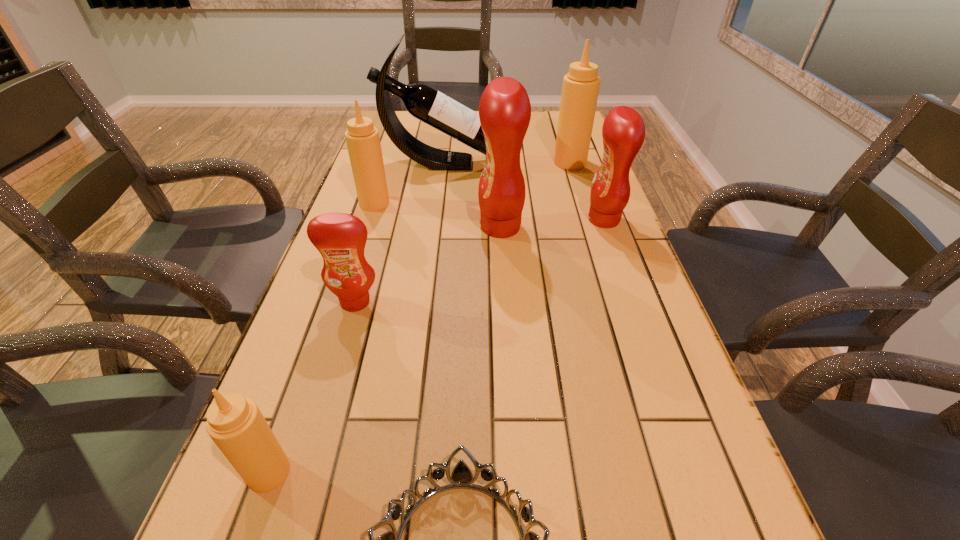
This screenshot has height=540, width=960. What are the coordinates of `wine bottle` in the screenshot? It's located at (423, 102).

The height and width of the screenshot is (540, 960). Find the location of `the biggest red condiment`. the biggest red condiment is located at coordinates pos(504,110).

You are a GUI agent. You are given a task and a screenshot of the screen. Output one action in this format:
    pyautogui.click(x=<x>, y=<y>)
    Task: Click on the fourth condiment from left to right
    Image resolution: width=960 pixels, height=540 pixels.
    Given the screenshot: What is the action you would take?
    pyautogui.click(x=504, y=110)

Where is `the farthest condiment`? The width and height of the screenshot is (960, 540). the farthest condiment is located at coordinates (580, 89).

This screenshot has height=540, width=960. I want to click on the biggest tan condiment, so click(x=580, y=89).

At what (x,y) coordinates should I click in order to perform the action: click on the second farthest tan condiment. Please return your answer as a coordinate pair (x, y). Looking at the image, I should click on (363, 142).

What are the coordinates of `the rightmost red condiment` in the screenshot? It's located at (623, 132).

You are a GUI agent. You are given a task and a screenshot of the screen. Output one action in this format:
    pyautogui.click(x=<x>, y=<y>)
    Task: Click on the nearest red condiment
    The width and height of the screenshot is (960, 540).
    Given the screenshot: What is the action you would take?
    pyautogui.click(x=340, y=238)

This screenshot has height=540, width=960. Identify the location of the second nearest condiment. (340, 238).

Where is `the nearest condiment`? Image resolution: width=960 pixels, height=540 pixels. the nearest condiment is located at coordinates (236, 425).